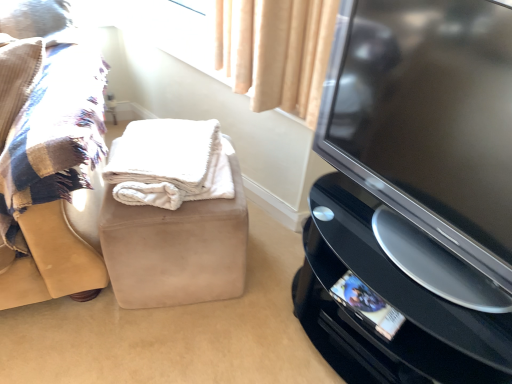
Question: Is black glossy tv at right oriented away from beige suede ottoman at center, positioned as the second furniture in left-to-right order?

Choices:
 (A) yes
 (B) no

Answer: (B)

Question: Is there a large distance between black glossy tv at right and beige suede ottoman at center, positioned as the second furniture in left-to-right order?

Choices:
 (A) no
 (B) yes

Answer: (A)

Question: Is black glossy tv at right in front of beige suede ottoman at center, which ranks as the 1th furniture in right-to-left order?

Choices:
 (A) no
 (B) yes

Answer: (B)

Question: Is black glossy tv at right further to camera compared to beige suede ottoman at center, positioned as the second furniture in left-to-right order?

Choices:
 (A) no
 (B) yes

Answer: (A)

Question: Is black glossy tv at right wider than beige suede ottoman at center, which ranks as the 1th furniture in right-to-left order?

Choices:
 (A) no
 (B) yes

Answer: (A)

Question: Based on their positions, is black glossy tv at right located to the left or right of beige suede ottoman at center, which ranks as the 1th furniture in right-to-left order?

Choices:
 (A) left
 (B) right

Answer: (B)

Question: In terms of height, does black glossy tv at right look taller or shorter compared to beige suede ottoman at center, positioned as the second furniture in left-to-right order?

Choices:
 (A) tall
 (B) short

Answer: (A)

Question: Is black glossy tv at right in front of or behind beige suede ottoman at center, positioned as the second furniture in left-to-right order, in the image?

Choices:
 (A) front
 (B) behind

Answer: (A)

Question: Would you say black glossy tv at right is inside or outside beige suede ottoman at center, positioned as the second furniture in left-to-right order?

Choices:
 (A) inside
 (B) outside

Answer: (B)

Question: Does point (146, 271) appear closer or farther from the camera than point (112, 193)?

Choices:
 (A) farther
 (B) closer

Answer: (A)

Question: Considering the positions of beige suede ottoman at center, positioned as the second furniture in left-to-right order, and white fluffy blanket at center in the image, is beige suede ottoman at center, positioned as the second furniture in left-to-right order, taller or shorter than white fluffy blanket at center?

Choices:
 (A) tall
 (B) short

Answer: (A)

Question: From a real-world perspective, is beige suede ottoman at center, which ranks as the 1th furniture in right-to-left order, physically located above or below white fluffy blanket at center?

Choices:
 (A) above
 (B) below

Answer: (B)

Question: Is beige suede ottoman at center, positioned as the second furniture in left-to-right order, bigger or smaller than white fluffy blanket at center?

Choices:
 (A) small
 (B) big

Answer: (B)

Question: From the image's perspective, is black glossy tv at right located above or below white fluffy blanket at center?

Choices:
 (A) below
 (B) above

Answer: (B)

Question: In terms of height, does black glossy tv at right look taller or shorter compared to white fluffy blanket at center?

Choices:
 (A) short
 (B) tall

Answer: (B)